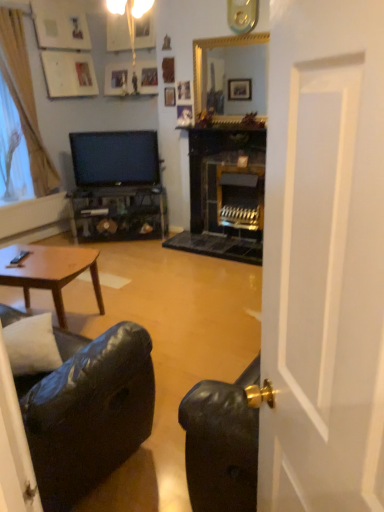
Question: Are black leather couch at lower left and gold-framed mirror at upper center beside each other?

Choices:
 (A) yes
 (B) no

Answer: (B)

Question: Can you confirm if black leather couch at lower left is taller than gold-framed mirror at upper center?

Choices:
 (A) yes
 (B) no

Answer: (A)

Question: Considering the relative sizes of black leather couch at lower left and gold-framed mirror at upper center in the image provided, is black leather couch at lower left smaller than gold-framed mirror at upper center?

Choices:
 (A) yes
 (B) no

Answer: (B)

Question: From the image's perspective, is black leather couch at lower left above gold-framed mirror at upper center?

Choices:
 (A) no
 (B) yes

Answer: (A)

Question: Can you confirm if black leather couch at lower left is positioned to the left of gold-framed mirror at upper center?

Choices:
 (A) no
 (B) yes

Answer: (B)

Question: Does point (167, 89) appear closer or farther from the camera than point (4, 267)?

Choices:
 (A) closer
 (B) farther

Answer: (B)

Question: From the image's perspective, is wooden picture frame at upper center positioned above or below brown wooden coffee table at lower left?

Choices:
 (A) below
 (B) above

Answer: (B)

Question: From a real-world perspective, is wooden picture frame at upper center above or below brown wooden coffee table at lower left?

Choices:
 (A) below
 (B) above

Answer: (B)

Question: Is wooden picture frame at upper center taller or shorter than brown wooden coffee table at lower left?

Choices:
 (A) short
 (B) tall

Answer: (A)

Question: Would you say wooden picture frame at upper center is to the left or to the right of white soft pillow at lower left in the picture?

Choices:
 (A) left
 (B) right

Answer: (B)

Question: In terms of width, does wooden picture frame at upper center look wider or thinner when compared to white soft pillow at lower left?

Choices:
 (A) wide
 (B) thin

Answer: (B)

Question: From their relative heights in the image, would you say wooden picture frame at upper center is taller or shorter than white soft pillow at lower left?

Choices:
 (A) tall
 (B) short

Answer: (B)

Question: Is point (173, 88) positioned closer to the camera than point (24, 373)?

Choices:
 (A) farther
 (B) closer

Answer: (A)

Question: From a real-world perspective, relative to matte black tv at center, is wooden picture frame at upper center vertically above or below?

Choices:
 (A) below
 (B) above

Answer: (B)

Question: Is wooden picture frame at upper center situated inside matte black tv at center or outside?

Choices:
 (A) inside
 (B) outside

Answer: (B)